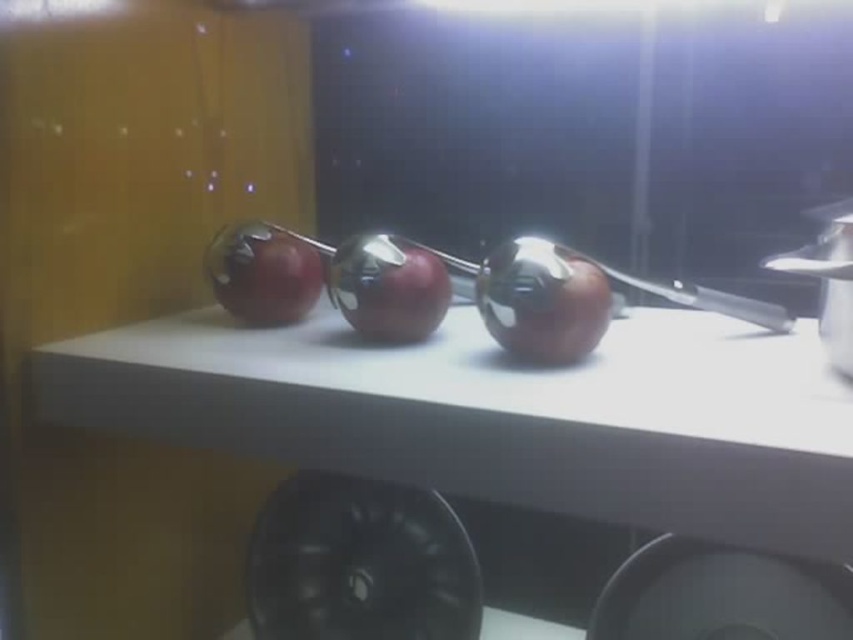
You are taking a photo of the apples and notice two points in the image labeled as point (33, 362) and point (375, 307). Which point is closer to the camera?

Point (33, 362) is further to the camera than point (375, 307), so the closer point to the camera is point (375, 307).

You need to place a small salt shaker on the white matte counter top at center without covering the shiny red apple at center. Is there enough space?

The white matte counter top at center is bigger than the shiny red apple at center, so there should be enough space to place the salt shaker without covering the apple.